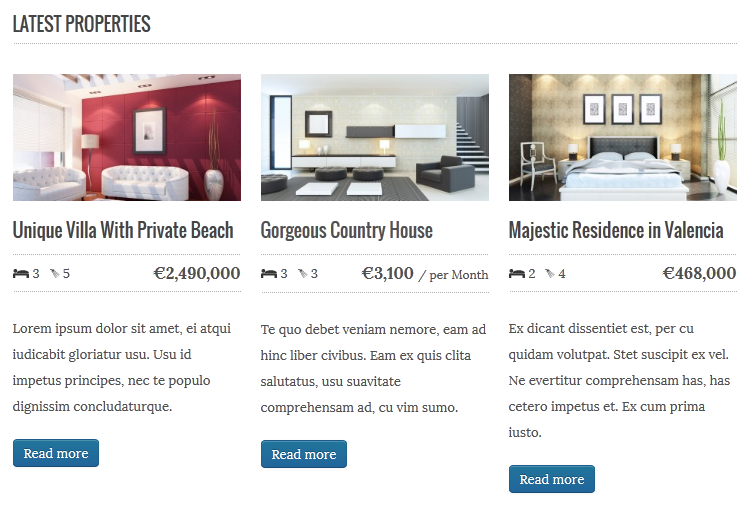
Find the location of a particular element. lamps is located at coordinates (89, 144), (385, 144), (302, 144), (572, 150), (675, 153).